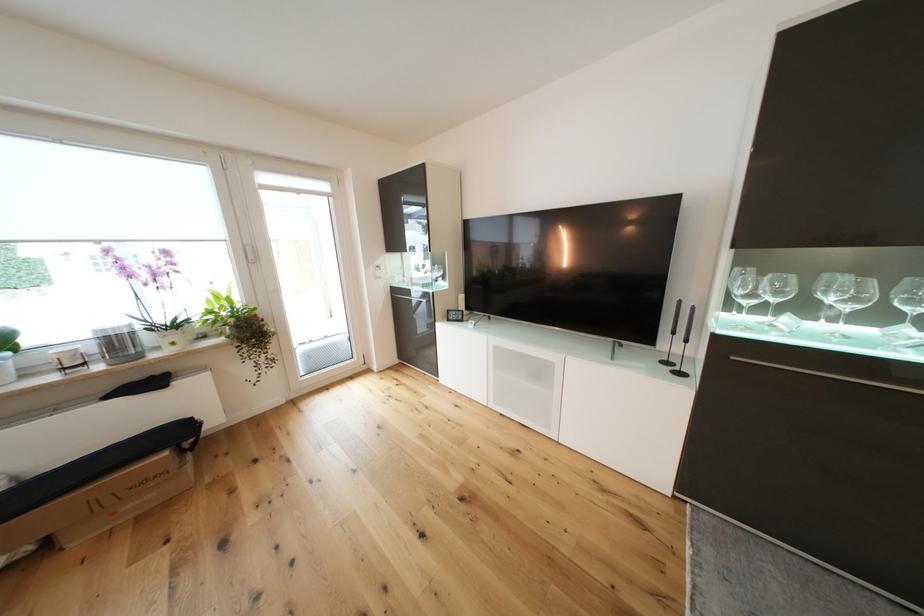
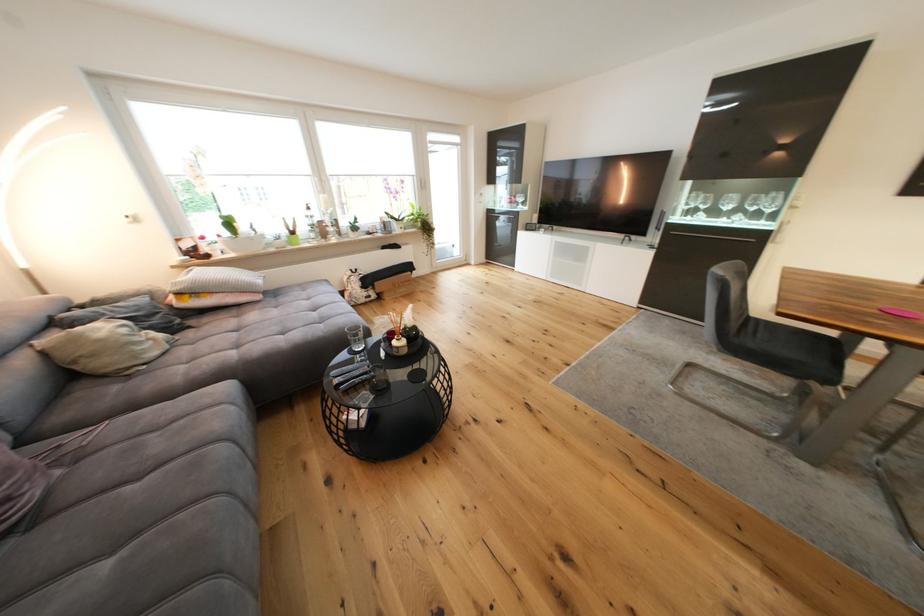
The point at [744,270] is marked in the first image. Where is the corresponding point in the second image?

(701, 195)